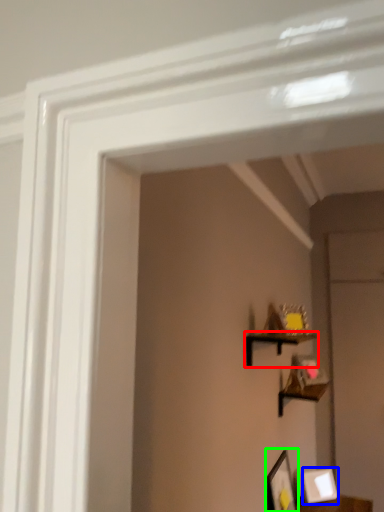
Question: Which object is the farthest from shelf (highlighted by a red box)? Choose among these: picture frame (highlighted by a blue box) or picture frame (highlighted by a green box).

Choices:
 (A) picture frame
 (B) picture frame

Answer: (A)